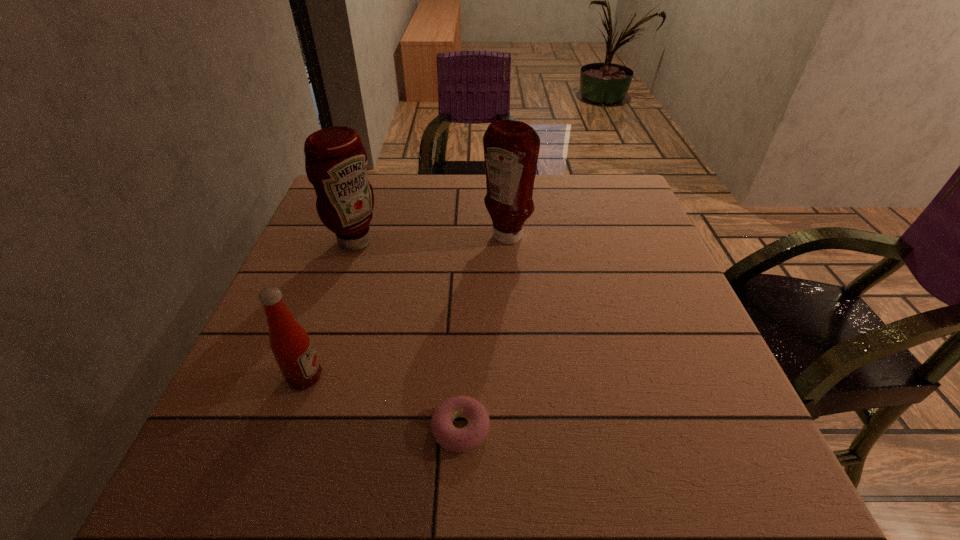
Where is `vacant space at the near edge`? This screenshot has width=960, height=540. vacant space at the near edge is located at coordinates (x=623, y=502).

This screenshot has height=540, width=960. I want to click on blank space at the left edge, so click(341, 255).

Identify the location of vacant space at the right edge of the desktop. (669, 341).

In the image, there is a desktop. Identify the location of blank space at the far right corner. (599, 216).

The image size is (960, 540). In order to click on blank space at the near right corner of the desktop in this screenshot , I will do `click(708, 495)`.

Where is `free space between the nearest object and the rightmost condiment`? The image size is (960, 540). free space between the nearest object and the rightmost condiment is located at coordinates (484, 333).

You are a GUI agent. You are given a task and a screenshot of the screen. Output one action in this format:
    pyautogui.click(x=<x>, y=<y>)
    Task: Click on the vacant area between the rightmost condiment and the doughnut
    The height and width of the screenshot is (540, 960).
    Given the screenshot: What is the action you would take?
    pyautogui.click(x=484, y=333)

This screenshot has height=540, width=960. What are the coordinates of `free area in between the shortest object and the rightmost condiment` in the screenshot? It's located at (484, 333).

Find the location of a particular element. unoccupied area between the rightmost condiment and the third tallest object is located at coordinates [x=406, y=308].

Choose which object is the nearest neighbor to the second shortest object. Please provide its 2D coordinates. Your answer should be formatted as a tuple, i.e. [(x, y)], where the tuple contains the x and y coordinates of a point satisfying the conditions above.

[(453, 439)]